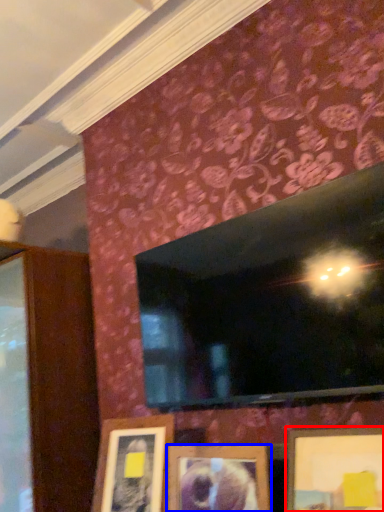
Question: Which point is further to the camera, picture frame (highlighted by a red box) or picture frame (highlighted by a blue box)?

Choices:
 (A) picture frame
 (B) picture frame

Answer: (B)